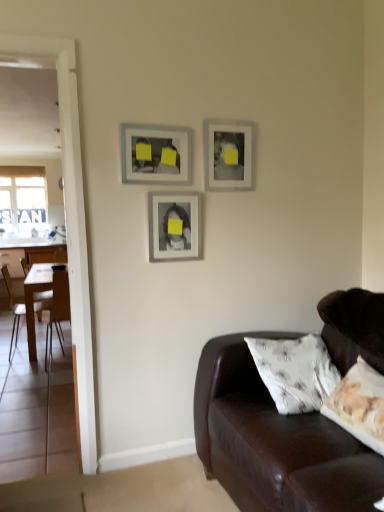
Question: Do you think matte black picture frame at upper center, positioned as the first picture frame in left-to-right order, is within white glossy table at left, or outside of it?

Choices:
 (A) outside
 (B) inside

Answer: (A)

Question: In terms of width, does matte black picture frame at upper center, which is counted as the 3th picture frame, starting from the right, look wider or thinner when compared to white glossy table at left?

Choices:
 (A) thin
 (B) wide

Answer: (A)

Question: Considering the real-world distances, which object is farthest from the matte black picture frame at upper center, which is counted as the 3th picture frame, starting from the right?

Choices:
 (A) transparent glass door at left
 (B) wooden chair at left, which is the second chair in left-to-right order
 (C) transparent glass window at left
 (D) light brown wooden chair at left, the 1th chair in the left-to-right sequence
 (E) matte silver picture frame at center, which is counted as the 2th picture frame, starting from the left

Answer: (C)

Question: Which of these objects is positioned closest to the matte silver picture frame at center, the second picture frame positioned from the right?

Choices:
 (A) transparent glass door at left
 (B) light brown wooden chair at left, the second chair viewed from the right
 (C) matte black picture frame at upper center, which is counted as the 3th picture frame, starting from the right
 (D) wooden chair at left, which is the second chair in left-to-right order
 (E) matte gray picture frame at upper center, which ranks as the 3th picture frame in left-to-right order

Answer: (C)